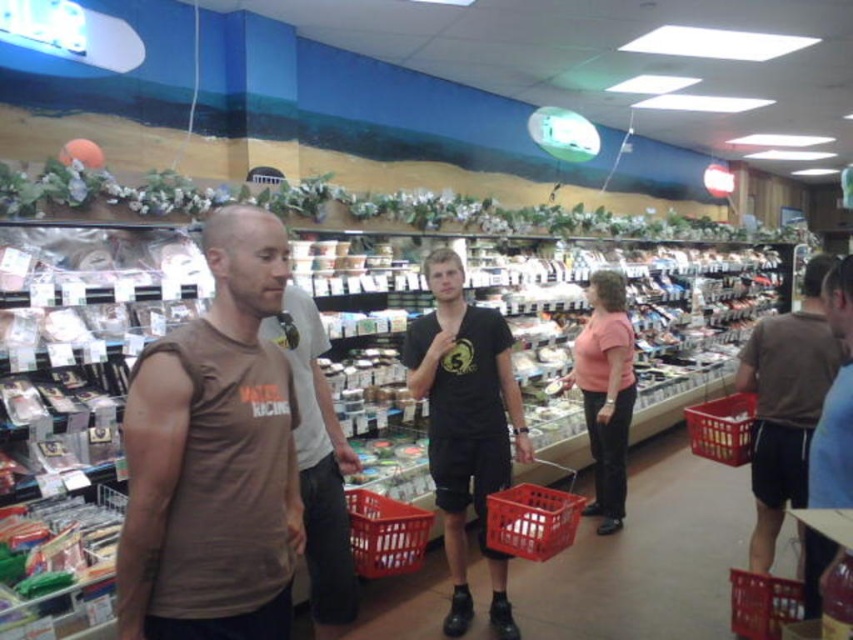
Is brown matte t-shirt at left shorter than brown cotton t-shirt at right?

Yes.

From the picture: Can you confirm if brown matte t-shirt at left is wider than brown cotton t-shirt at right?

In fact, brown matte t-shirt at left might be narrower than brown cotton t-shirt at right.

Between point (138, 371) and point (850, 371), which one is positioned in front?

Point (138, 371) is more forward.

Image resolution: width=853 pixels, height=640 pixels. Find the location of `brown matte t-shirt at left`. brown matte t-shirt at left is located at coordinates (213, 456).

At what (x,y) coordinates should I click in order to perform the action: click on brown matte t-shirt at left. Please return your answer as a coordinate pair (x, y). The image size is (853, 640). Looking at the image, I should click on (213, 456).

Which of these two, brown matte t-shirt at left or plastic basket at lower right, stands shorter?

With less height is plastic basket at lower right.

Which is in front, point (267, 515) or point (775, 609)?

Point (267, 515) is more forward.

The image size is (853, 640). Identify the location of brown matte t-shirt at left. (213, 456).

Can you confirm if brown cotton t-shirt at right is wider than pink matte shirt at center?

Yes, brown cotton t-shirt at right is wider than pink matte shirt at center.

Where is `brown cotton t-shirt at right`? This screenshot has height=640, width=853. brown cotton t-shirt at right is located at coordinates (833, 400).

Identify the location of brown cotton t-shirt at right. This screenshot has height=640, width=853. (833, 400).